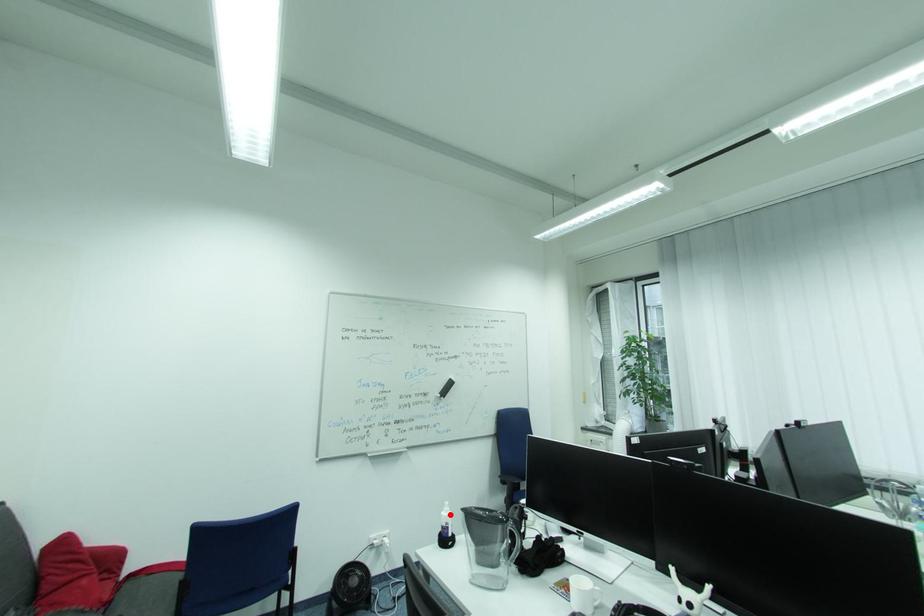
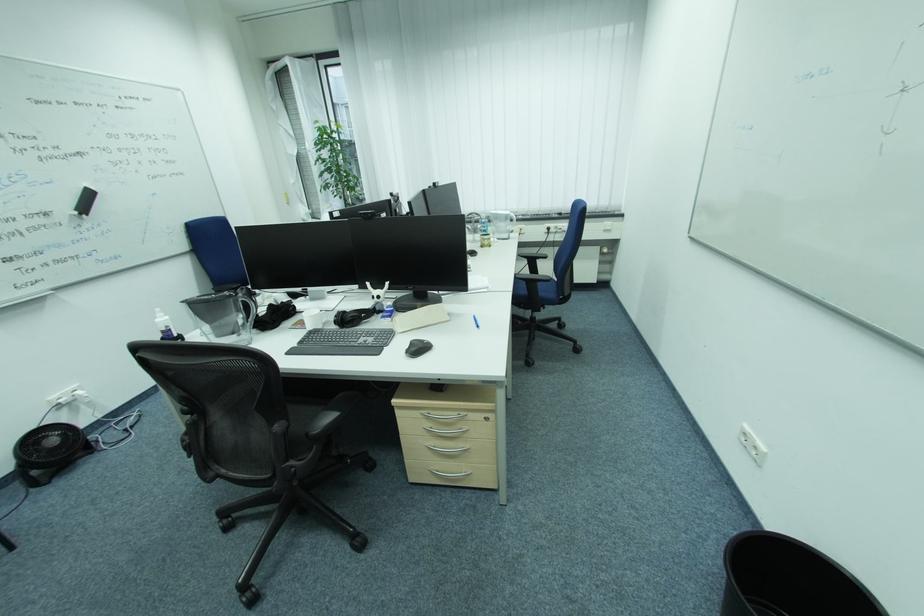
Locate, in the second image, the point that corresponds to the highlighted location in the first image.

(164, 321)